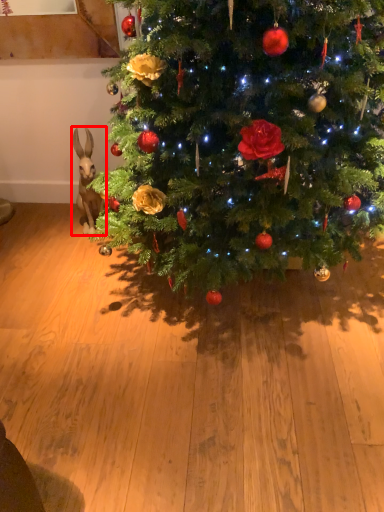
Question: Observing the image, what is the correct spatial positioning of animal (annotated by the red box) in reference to christmas tree?

Choices:
 (A) right
 (B) left

Answer: (B)